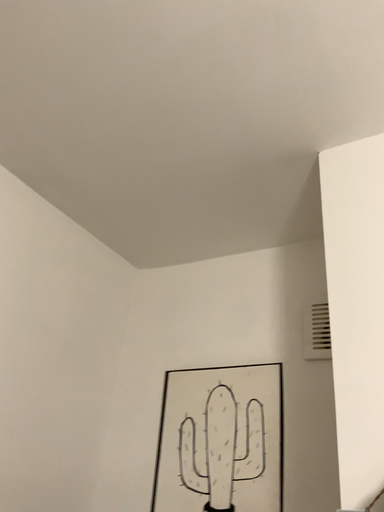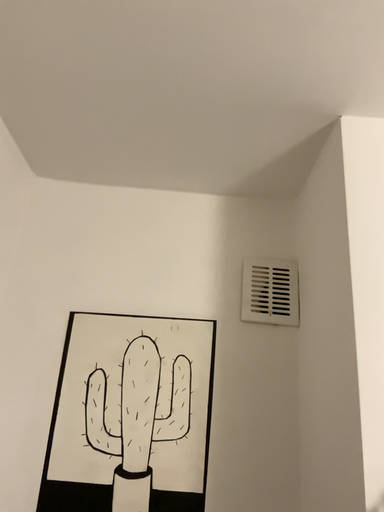
Question: How did the camera likely rotate when shooting the video?

Choices:
 (A) rotated upward
 (B) rotated downward

Answer: (B)